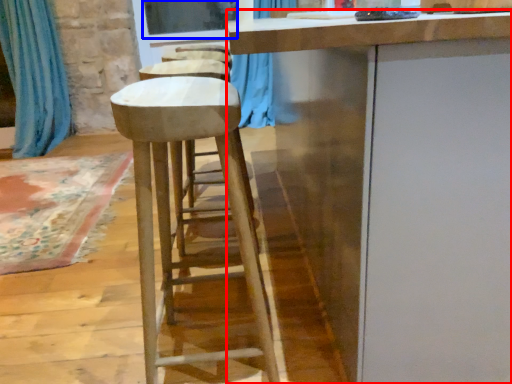
Question: Which of the following is the closest to the observer, cabinetry (highlighted by a red box) or window screen (highlighted by a blue box)?

Choices:
 (A) cabinetry
 (B) window screen

Answer: (A)